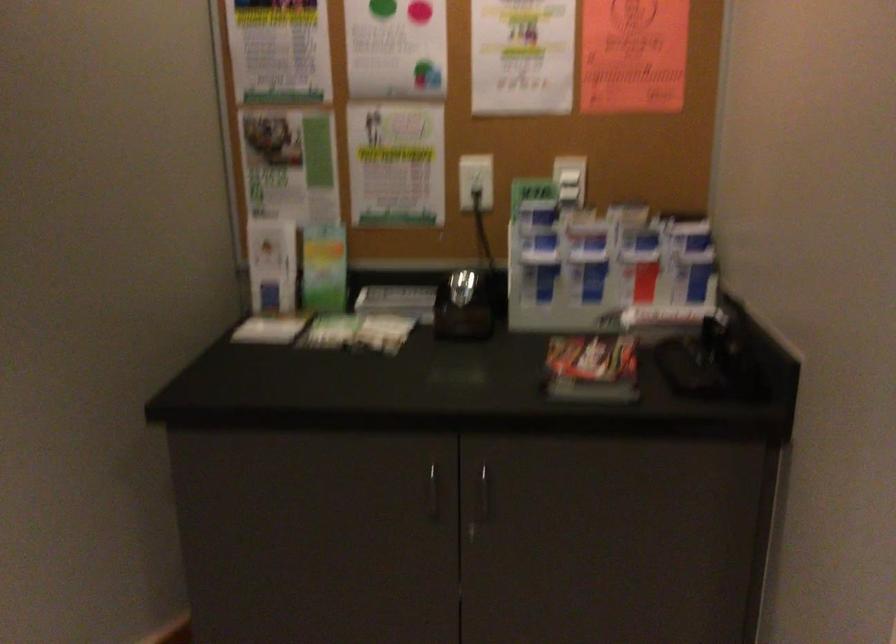
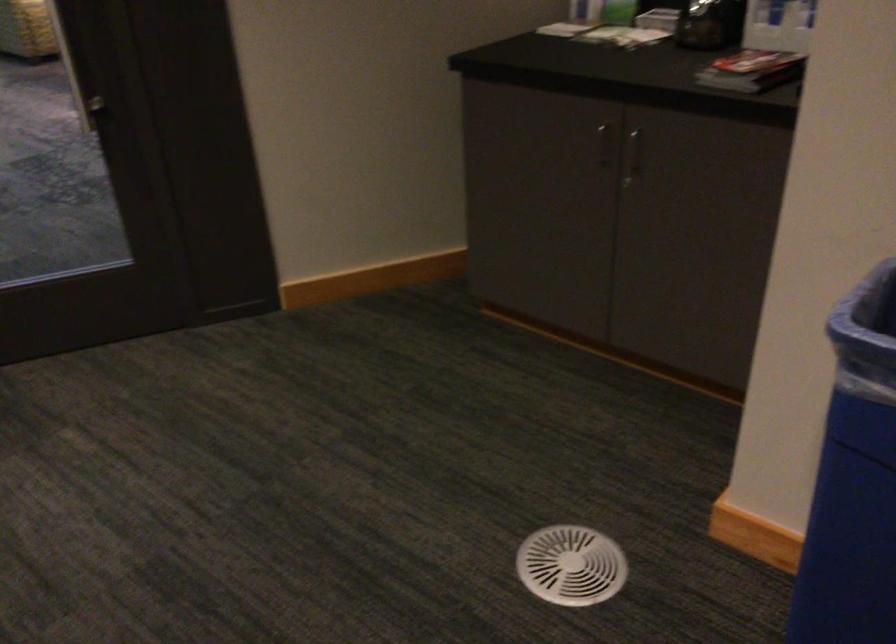
Locate, in the second image, the point that corresponds to (610,377) in the first image.

(751, 71)